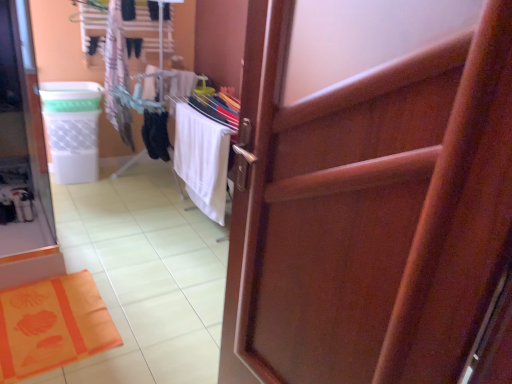
Question: Is white plastic laundry basket at left in front of or behind wooden door at center in the image?

Choices:
 (A) behind
 (B) front

Answer: (A)

Question: From their relative heights in the image, would you say white plastic laundry basket at left is taller or shorter than wooden door at center?

Choices:
 (A) short
 (B) tall

Answer: (A)

Question: Which object is positioned farthest from the wooden door at center?

Choices:
 (A) white cotton towel at upper left
 (B) white fabric beach towel at center
 (C) orange fabric bath mat at lower left
 (D) white plastic laundry basket at left

Answer: (D)

Question: Considering the real-world distances, which object is farthest from the white fabric beach towel at center?

Choices:
 (A) orange fabric bath mat at lower left
 (B) white cotton towel at upper left
 (C) white plastic laundry basket at left
 (D) wooden door at center

Answer: (D)